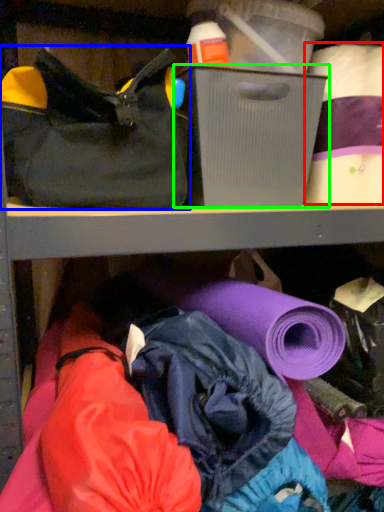
Question: Considering the real-world distances, which object is farthest from toilet paper (highlighted by a red box)? handbag (highlighted by a blue box) or storage box (highlighted by a green box)?

Choices:
 (A) handbag
 (B) storage box

Answer: (A)